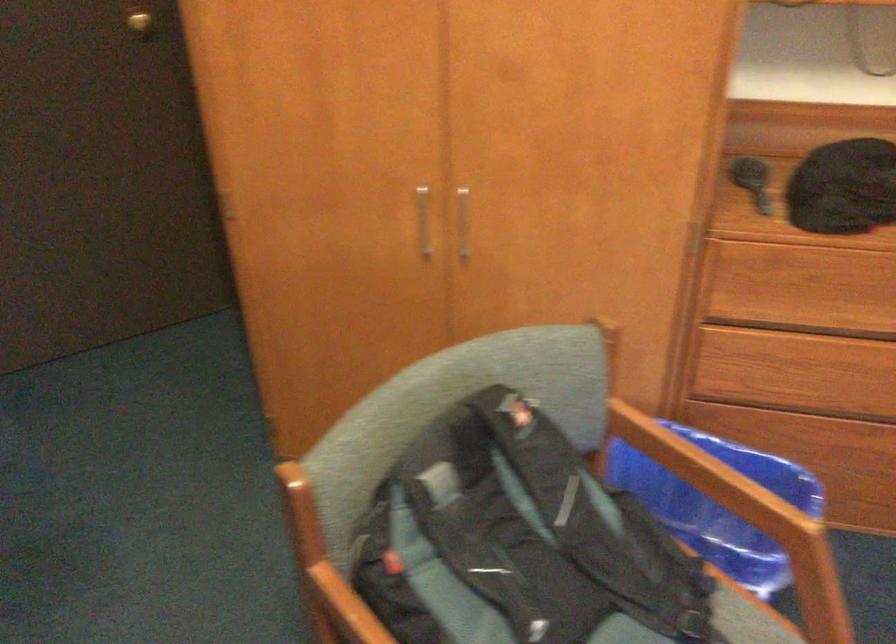
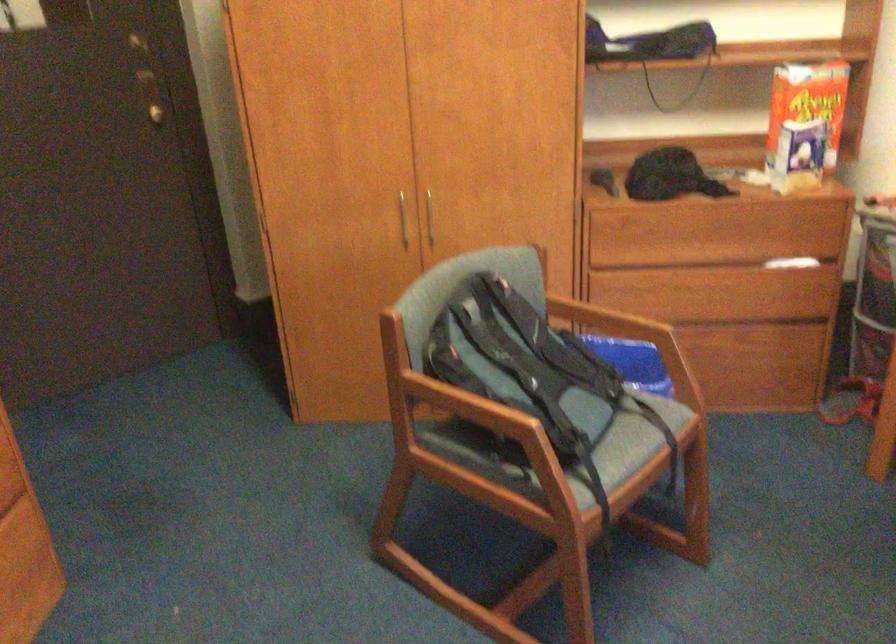
Question: The images are taken continuously from a first-person perspective. In which direction is your viewpoint rotating?

Choices:
 (A) Left
 (B) Right
 (C) Up
 (D) Down

Answer: (B)